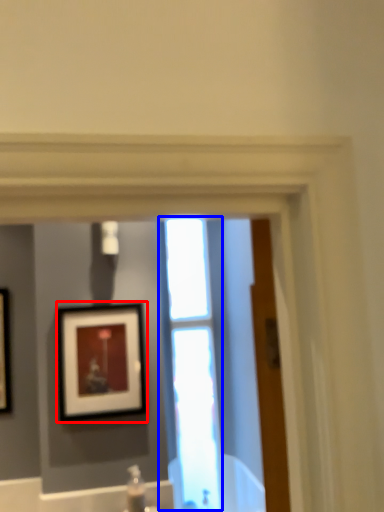
Question: Which object is closer to the camera taking this photo, picture frame (highlighted by a red box) or window (highlighted by a blue box)?

Choices:
 (A) picture frame
 (B) window

Answer: (A)